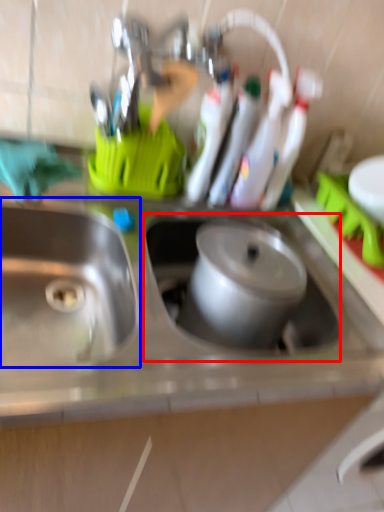
Question: Which object appears farthest to the camera in this image, sink (highlighted by a red box) or sink (highlighted by a blue box)?

Choices:
 (A) sink
 (B) sink

Answer: (A)